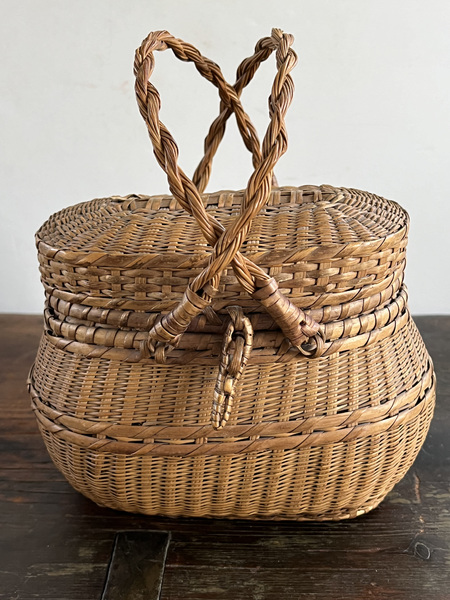
The width and height of the screenshot is (450, 600). What are the coordinates of `border of brown table and white background wall` in the screenshot? It's located at (448, 315), (431, 316), (6, 315), (29, 314).